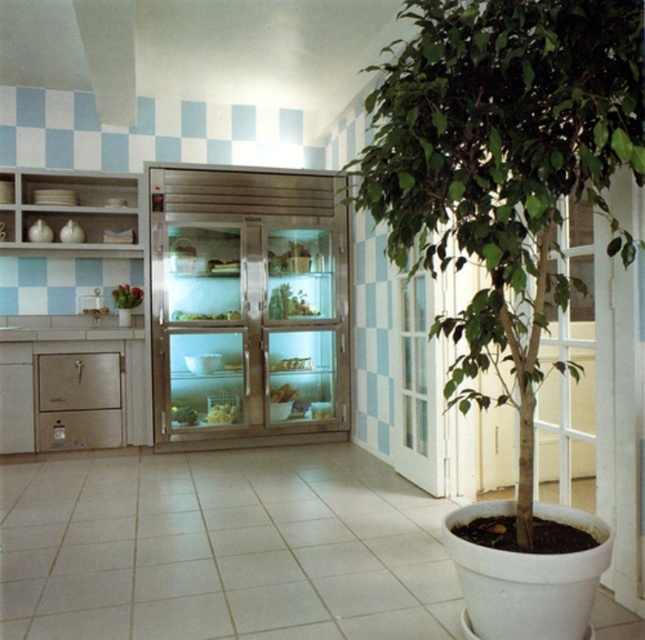
You are organizing the kitchen shelves and need to place both the green leafy plant at center and the green leafy vegetables at center. Considering their heights, which one should be placed on the lower shelf to prevent it from being knocked over?

The green leafy vegetables at center should be placed on the lower shelf because they are shorter than the green leafy plant at center, which can be placed higher to avoid being knocked over.

You are organizing the kitchen and need to place a new item on the shelf above the refrigerator. You have a green leafy plant at center and green leafy vegetables at center. Which one should be placed closer to you so that it is visible from the front?

The green leafy plant at center should be placed closer to you because it is in front of the green leafy vegetables at center, making it more visible from the front.

You are organizing the kitchen shelves and notice both the green leafy plant at center and the green leafy vegetables at center. Which one is placed higher up?

The green leafy plant at center is positioned over the green leafy vegetables at center, so it is placed higher up.